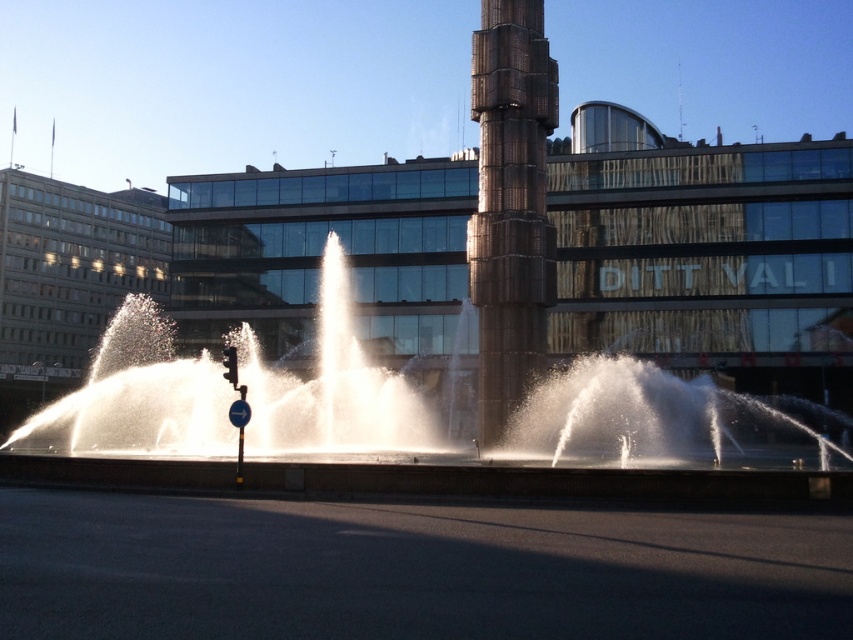
Does white water at center have a lesser height compared to rustic metal column at center?

Indeed, white water at center has a lesser height compared to rustic metal column at center.

Who is positioned more to the right, white water at center or rustic metal column at center?

rustic metal column at center is more to the right.

Where is `white water at center`? This screenshot has width=853, height=640. white water at center is located at coordinates pyautogui.click(x=383, y=429).